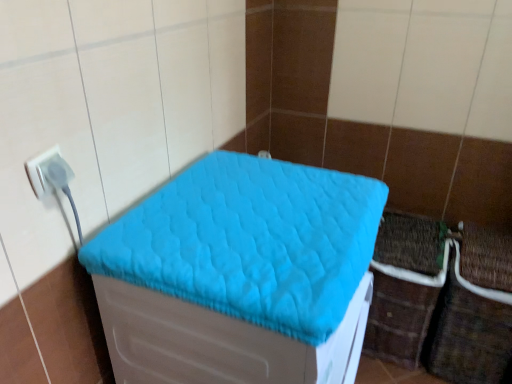
Question: Considering the relative sizes of white plastic plug at left and brown woven crate at lower right in the image provided, is white plastic plug at left thinner than brown woven crate at lower right?

Choices:
 (A) yes
 (B) no

Answer: (A)

Question: Does white plastic plug at left have a lesser height compared to brown woven crate at lower right?

Choices:
 (A) no
 (B) yes

Answer: (B)

Question: Can you confirm if white plastic plug at left is wider than brown woven crate at lower right?

Choices:
 (A) yes
 (B) no

Answer: (B)

Question: From a real-world perspective, is white plastic plug at left on top of brown woven crate at lower right?

Choices:
 (A) yes
 (B) no

Answer: (A)

Question: From a real-world perspective, is white plastic plug at left physically below brown woven crate at lower right?

Choices:
 (A) yes
 (B) no

Answer: (B)

Question: Considering the positions of turquoise quilted cushion at center and white plastic plug at left in the image, is turquoise quilted cushion at center taller or shorter than white plastic plug at left?

Choices:
 (A) short
 (B) tall

Answer: (A)

Question: From the image's perspective, is turquoise quilted cushion at center above or below white plastic plug at left?

Choices:
 (A) above
 (B) below

Answer: (B)

Question: Considering the relative positions of turquoise quilted cushion at center and white plastic plug at left in the image provided, is turquoise quilted cushion at center to the left or to the right of white plastic plug at left?

Choices:
 (A) right
 (B) left

Answer: (A)

Question: In the image, is turquoise quilted cushion at center positioned in front of or behind white plastic plug at left?

Choices:
 (A) front
 (B) behind

Answer: (A)

Question: From a real-world perspective, is brown woven crate at lower right physically located above or below white plastic plug at left?

Choices:
 (A) above
 (B) below

Answer: (B)

Question: From the image's perspective, is brown woven crate at lower right located above or below white plastic plug at left?

Choices:
 (A) below
 (B) above

Answer: (A)

Question: Is brown woven crate at lower right spatially inside white plastic plug at left, or outside of it?

Choices:
 (A) inside
 (B) outside

Answer: (B)

Question: In the image, is brown woven crate at lower right on the left side or the right side of white plastic plug at left?

Choices:
 (A) left
 (B) right

Answer: (B)

Question: Is white plastic plug at left bigger or smaller than turquoise quilted cushion at center?

Choices:
 (A) big
 (B) small

Answer: (B)

Question: Do you think white plastic plug at left is within turquoise quilted cushion at center, or outside of it?

Choices:
 (A) inside
 (B) outside

Answer: (B)